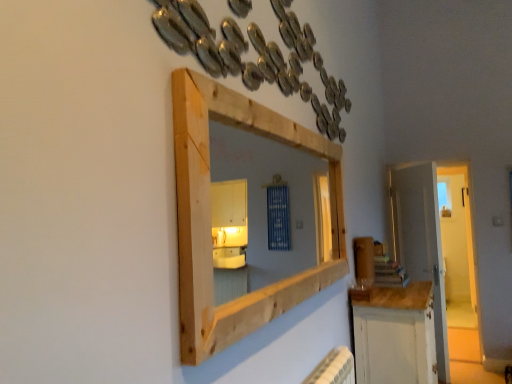
Question: Is white wooden door at right at the back of natural wood medicine cabinet at upper center?

Choices:
 (A) yes
 (B) no

Answer: (B)

Question: Is the surface of natural wood medicine cabinet at upper center in direct contact with white wooden door at right?

Choices:
 (A) no
 (B) yes

Answer: (A)

Question: From the image's perspective, would you say natural wood medicine cabinet at upper center is shown under white wooden door at right?

Choices:
 (A) no
 (B) yes

Answer: (A)

Question: From a real-world perspective, is natural wood medicine cabinet at upper center located higher than white wooden door at right?

Choices:
 (A) yes
 (B) no

Answer: (A)

Question: Is natural wood medicine cabinet at upper center smaller than white wooden door at right?

Choices:
 (A) no
 (B) yes

Answer: (B)

Question: Does point coord(331,269) appear closer or farther from the camera than point coord(428,223)?

Choices:
 (A) closer
 (B) farther

Answer: (A)

Question: From a real-world perspective, is natural wood medicine cabinet at upper center above or below white wooden door at right?

Choices:
 (A) above
 (B) below

Answer: (A)

Question: Considering their positions, is natural wood medicine cabinet at upper center located in front of or behind white wooden door at right?

Choices:
 (A) front
 (B) behind

Answer: (A)

Question: Is natural wood medicine cabinet at upper center taller or shorter than white wooden door at right?

Choices:
 (A) short
 (B) tall

Answer: (A)

Question: Does point (413, 296) appear closer or farther from the camera than point (430, 208)?

Choices:
 (A) closer
 (B) farther

Answer: (A)

Question: Looking at the image, does white painted wood cabinet at lower right seem bigger or smaller compared to white wooden door at right?

Choices:
 (A) small
 (B) big

Answer: (B)

Question: Is white painted wood cabinet at lower right inside or outside of white wooden door at right?

Choices:
 (A) outside
 (B) inside

Answer: (A)

Question: In terms of height, does white painted wood cabinet at lower right look taller or shorter compared to white wooden door at right?

Choices:
 (A) tall
 (B) short

Answer: (B)

Question: Is white painted wood cabinet at lower right situated inside natural wood medicine cabinet at upper center or outside?

Choices:
 (A) outside
 (B) inside

Answer: (A)

Question: Is point (422, 382) positioned closer to the camera than point (181, 175)?

Choices:
 (A) closer
 (B) farther

Answer: (B)